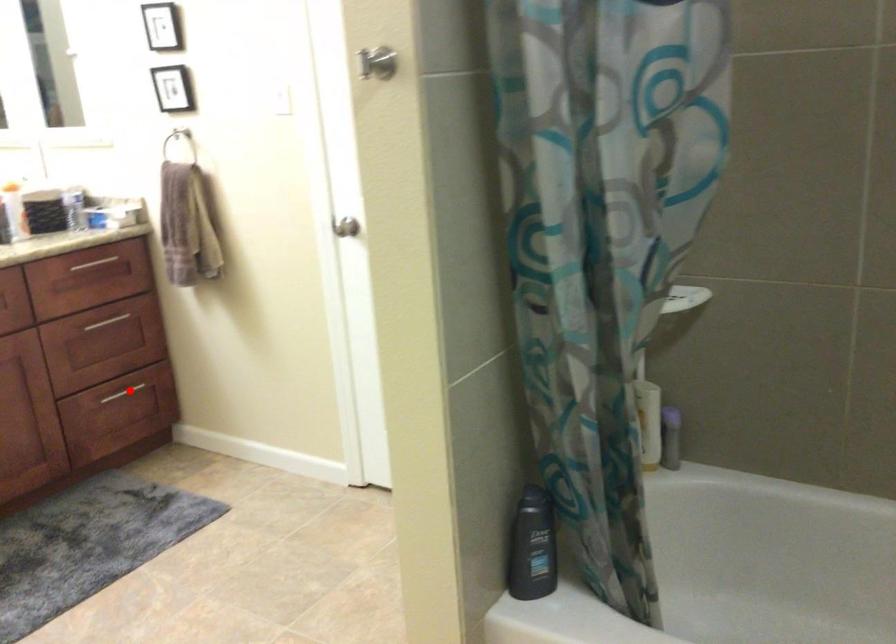
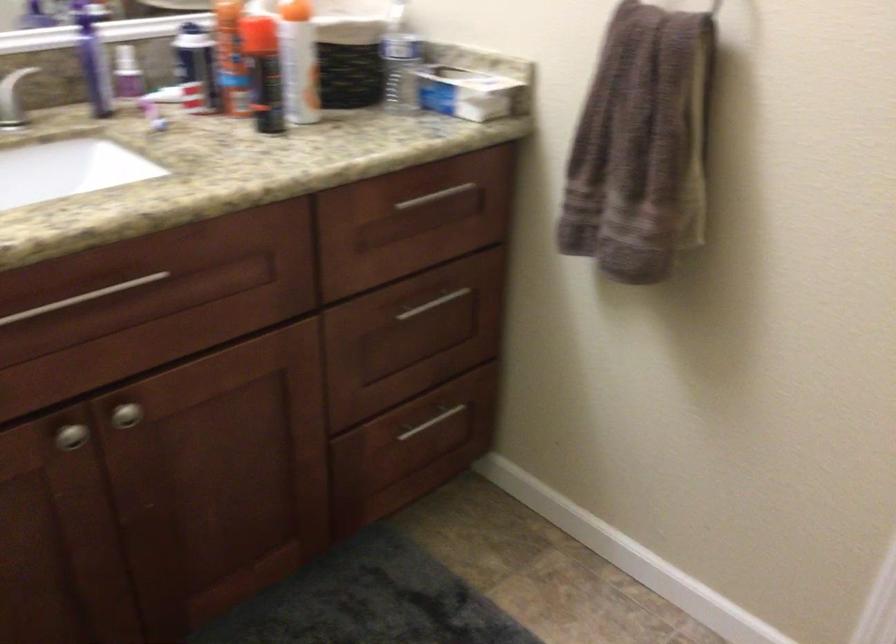
In the second image, find the point that corresponds to the highlighted location in the first image.

(432, 422)